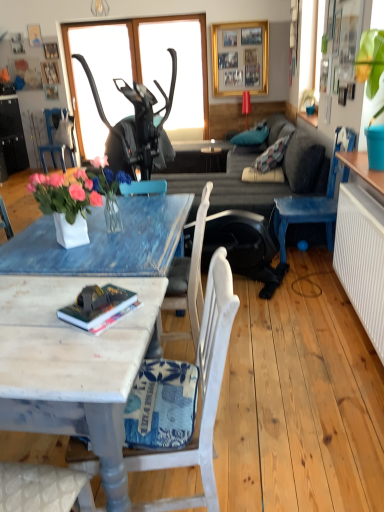
Question: Considering the relative sizes of gold metallic picture frame at upper center and dark gray fabric couch at center in the image provided, is gold metallic picture frame at upper center wider than dark gray fabric couch at center?

Choices:
 (A) yes
 (B) no

Answer: (B)

Question: Could dark gray fabric couch at center be considered to be inside gold metallic picture frame at upper center?

Choices:
 (A) yes
 (B) no

Answer: (B)

Question: Does gold metallic picture frame at upper center come in front of dark gray fabric couch at center?

Choices:
 (A) no
 (B) yes

Answer: (A)

Question: From the image's perspective, would you say gold metallic picture frame at upper center is positioned over dark gray fabric couch at center?

Choices:
 (A) yes
 (B) no

Answer: (A)

Question: Is gold metallic picture frame at upper center to the right of dark gray fabric couch at center from the viewer's perspective?

Choices:
 (A) yes
 (B) no

Answer: (A)

Question: Is gold metallic picture frame at upper center aimed at dark gray fabric couch at center?

Choices:
 (A) no
 (B) yes

Answer: (B)

Question: From a real-world perspective, is white painted wood chair at lower center, the 2th chair viewed from the left, on top of white ceramic vase at center?

Choices:
 (A) yes
 (B) no

Answer: (B)

Question: Is white painted wood chair at lower center, which appears as the 2th chair when viewed from the right, not within white ceramic vase at center?

Choices:
 (A) yes
 (B) no

Answer: (A)

Question: Is white painted wood chair at lower center, which is the third chair from top to bottom, further to camera compared to white ceramic vase at center?

Choices:
 (A) no
 (B) yes

Answer: (A)

Question: From the image's perspective, is white painted wood chair at lower center, which is the 1th chair in bottom-to-top order, on top of white ceramic vase at center?

Choices:
 (A) yes
 (B) no

Answer: (B)

Question: Are white painted wood chair at lower center, which appears as the 2th chair when viewed from the right, and white ceramic vase at center making contact?

Choices:
 (A) yes
 (B) no

Answer: (B)

Question: Is white painted wood chair at lower center, which is the third chair from top to bottom, positioned with its back to white ceramic vase at center?

Choices:
 (A) yes
 (B) no

Answer: (B)

Question: Is gold metallic picture frame at upper center positioned in front of blue painted wood chair at left, acting as the 1th chair starting from the top?

Choices:
 (A) yes
 (B) no

Answer: (A)